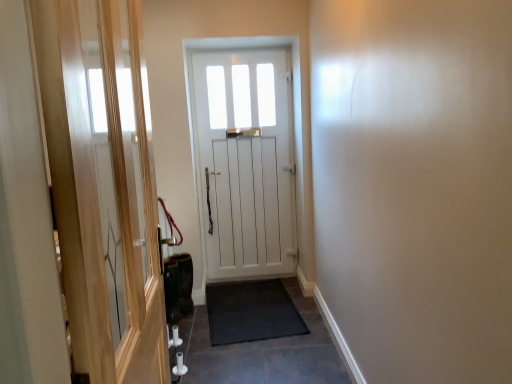
Locate an element on the screen. vacant space that is in between white wooden door at center and black rubber doormat at center is located at coordinates (296, 296).